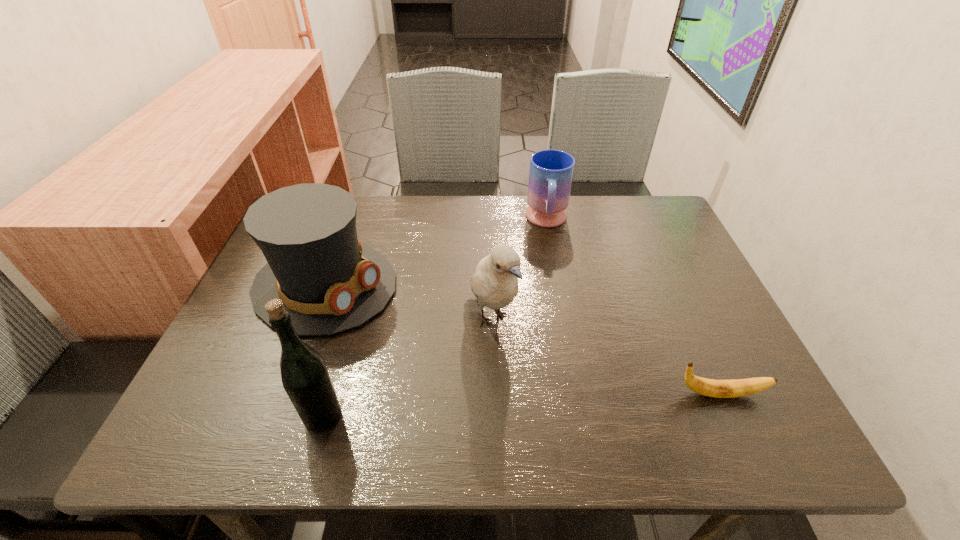
This screenshot has height=540, width=960. In order to click on free space between the tallest object and the banana in this screenshot , I will do `click(521, 405)`.

The height and width of the screenshot is (540, 960). Find the location of `free point between the third object from right to left and the dress hat`. free point between the third object from right to left and the dress hat is located at coordinates (408, 302).

Identify the location of empty location between the dress hat and the second shortest object. This screenshot has height=540, width=960. (436, 253).

Locate an element on the screen. This screenshot has height=540, width=960. free area in between the farthest object and the tallest object is located at coordinates (435, 319).

Locate an element on the screen. This screenshot has height=540, width=960. vacant space in between the fourth object from left to right and the dress hat is located at coordinates (436, 253).

Where is `free space between the dress hat and the fourth tallest object`? The image size is (960, 540). free space between the dress hat and the fourth tallest object is located at coordinates (436, 253).

Where is `unoccupied position between the beer bottle and the shortest object`? unoccupied position between the beer bottle and the shortest object is located at coordinates (521, 405).

What are the coordinates of `free space between the mug and the dress hat` in the screenshot? It's located at (436, 253).

Identify the location of vacant area between the shortest object and the third object from left to right. This screenshot has width=960, height=540. (605, 356).

I want to click on free space that is in between the shortest object and the third object from left to right, so click(x=605, y=356).